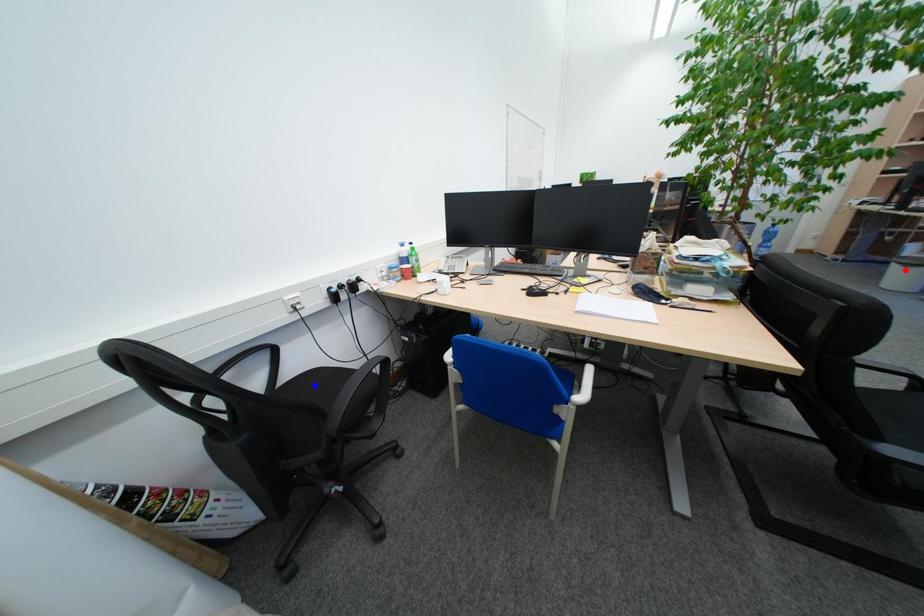
Question: Two points are marked on the image. Which point is closer to the camera?

Choices:
 (A) Blue point is closer.
 (B) Red point is closer.

Answer: (A)